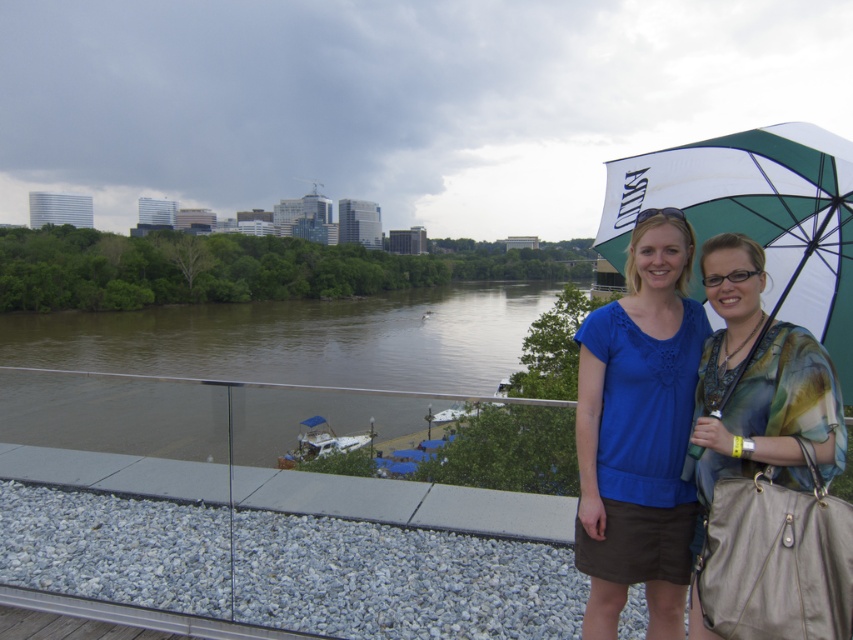
Question: Among these points, which one is farthest from the camera?

Choices:
 (A) (x=843, y=326)
 (B) (x=785, y=484)
 (C) (x=683, y=296)
 (D) (x=486, y=340)

Answer: (D)

Question: Considering the relative positions of brown water at lower left and green and white fabric umbrella at upper right in the image provided, where is brown water at lower left located with respect to green and white fabric umbrella at upper right?

Choices:
 (A) left
 (B) right

Answer: (A)

Question: Which point appears farthest from the camera in this image?

Choices:
 (A) (752, 634)
 (B) (662, 180)
 (C) (548, 396)

Answer: (C)

Question: Does multicolored fabric shirt at center have a larger size compared to green and white fabric umbrella at upper right?

Choices:
 (A) no
 (B) yes

Answer: (A)

Question: Estimate the real-world distances between objects in this image. Which object is farther from the brown water at lower left?

Choices:
 (A) green and white fabric umbrella at upper right
 (B) blue fabric shirt at center

Answer: (B)

Question: Is brown water at lower left smaller than blue fabric shirt at center?

Choices:
 (A) yes
 (B) no

Answer: (B)